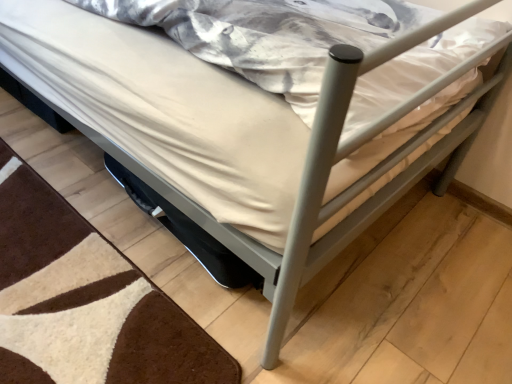
Find the location of a particular element. vacant space underneath brown textured mat at lower left (from a real-world perspective) is located at coordinates (67, 283).